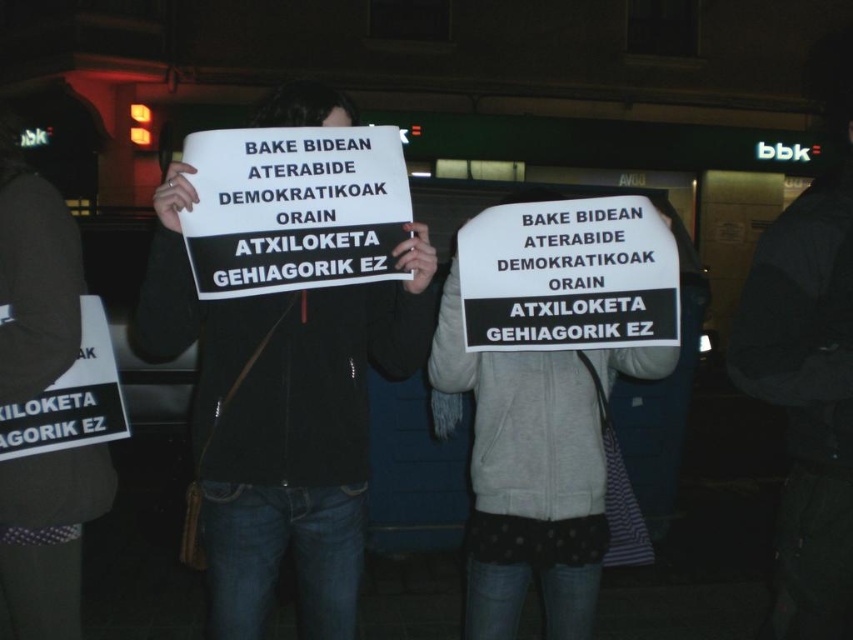
Question: Which object is the closest to the white fabric sign at center?

Choices:
 (A) white paper sign at center
 (B) black matte sign at center

Answer: (A)

Question: Does black matte sign at center appear on the right side of white fabric sign at center?

Choices:
 (A) yes
 (B) no

Answer: (B)

Question: Does white fabric sign at center have a larger size compared to white paper sign at center?

Choices:
 (A) no
 (B) yes

Answer: (B)

Question: Among these points, which one is farthest from the camera?

Choices:
 (A) (630, 262)
 (B) (271, 454)
 (C) (585, 541)

Answer: (C)

Question: Which object appears closest to the camera in this image?

Choices:
 (A) white paper sign at center
 (B) white fabric sign at center

Answer: (A)

Question: Does white fabric sign at center have a larger size compared to white paper sign at center?

Choices:
 (A) yes
 (B) no

Answer: (A)